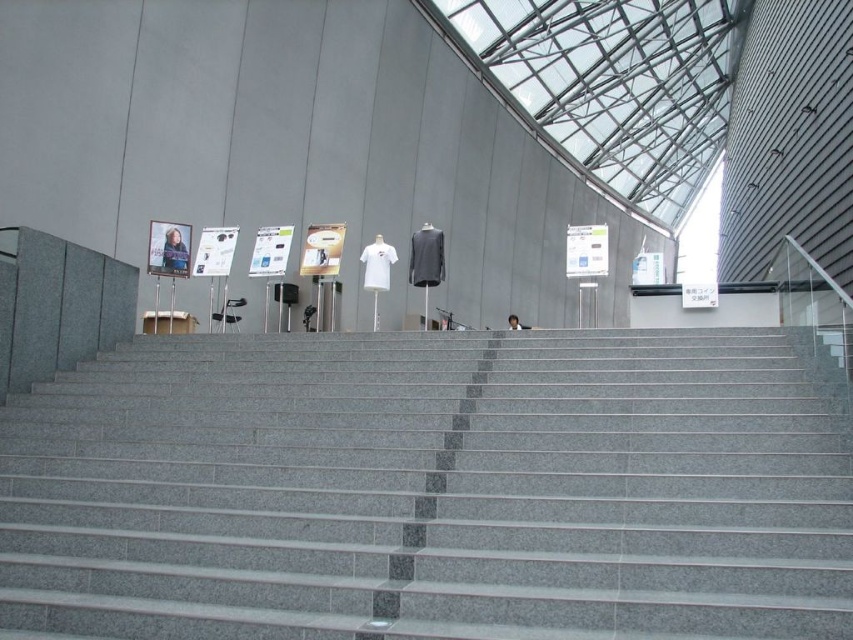
You are a person standing on the gray granite stairs at center and want to move to the light brown hair at center. Which direction should you move to reach it?

You should move to the right side because the gray granite stairs at center is positioned on the left side of light brown hair at center.

You are standing at the bottom of the staircase in the image. If you want to reach the upper level where the mannequins are, which direction should you move relative to the gray granite stairs at center?

You should move upwards along the gray granite stairs at center to reach the upper level where the mannequins are located.